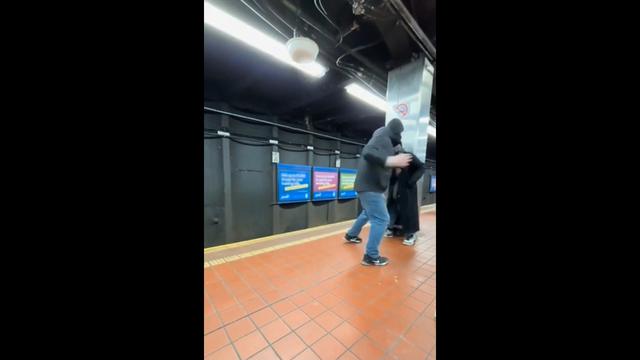
The width and height of the screenshot is (640, 360). Identify the location of ceiling. 435,13.